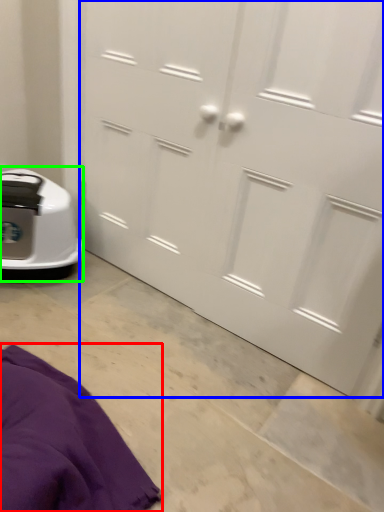
Question: Which is nearer to the blanket (highlighted by a red box)? door (highlighted by a blue box) or home appliance (highlighted by a green box).

Choices:
 (A) door
 (B) home appliance

Answer: (B)